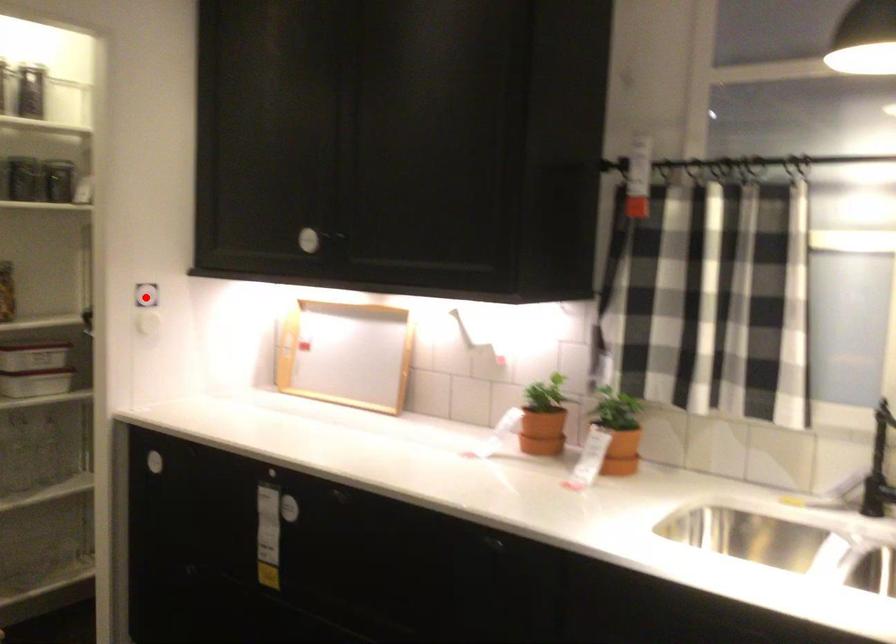
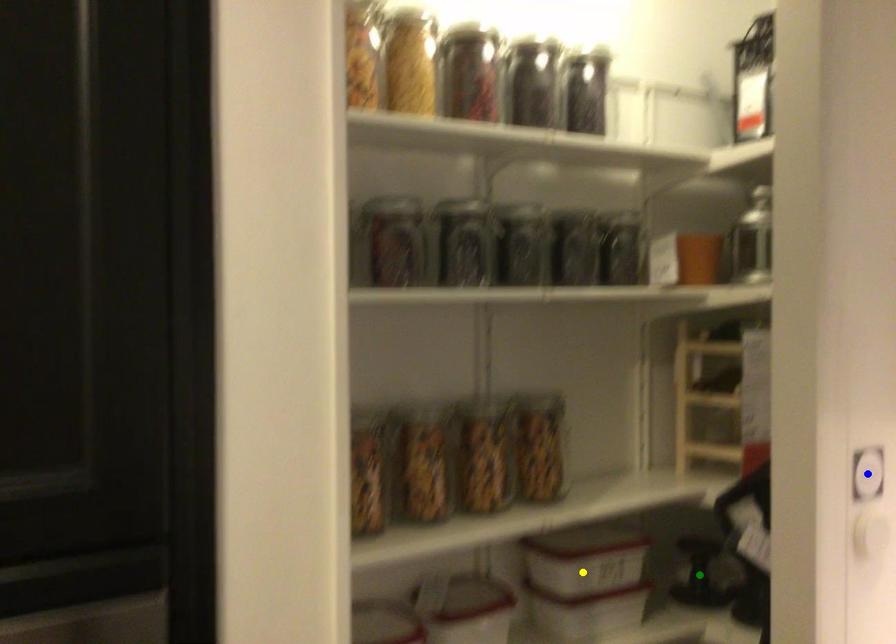
Question: I am providing you with two images of the same scene from different viewpoints. A red point is marked on the first image. You are given multiple points on the second image. Which mark in image 2 goes with the point in image 1?

Choices:
 (A) yellow point
 (B) green point
 (C) blue point

Answer: (C)